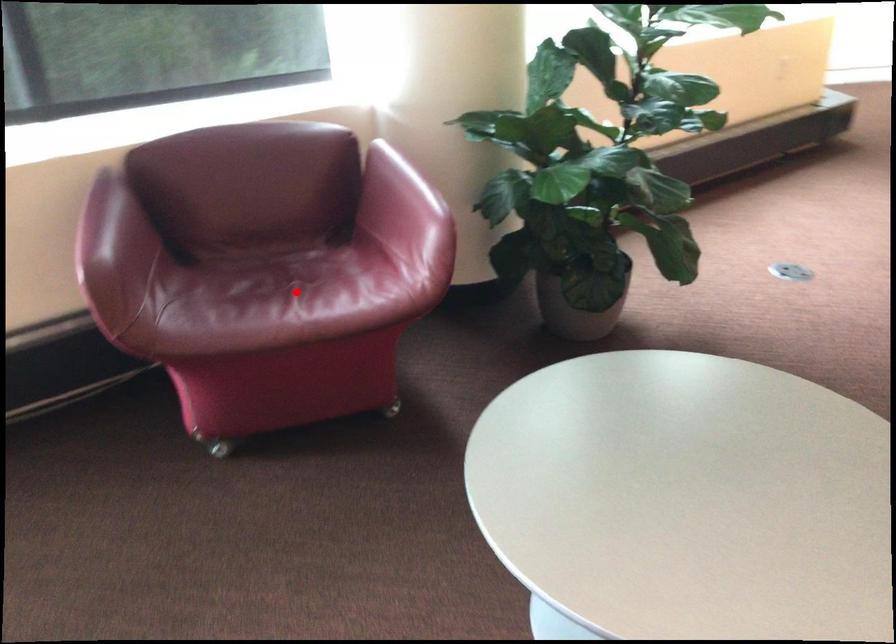
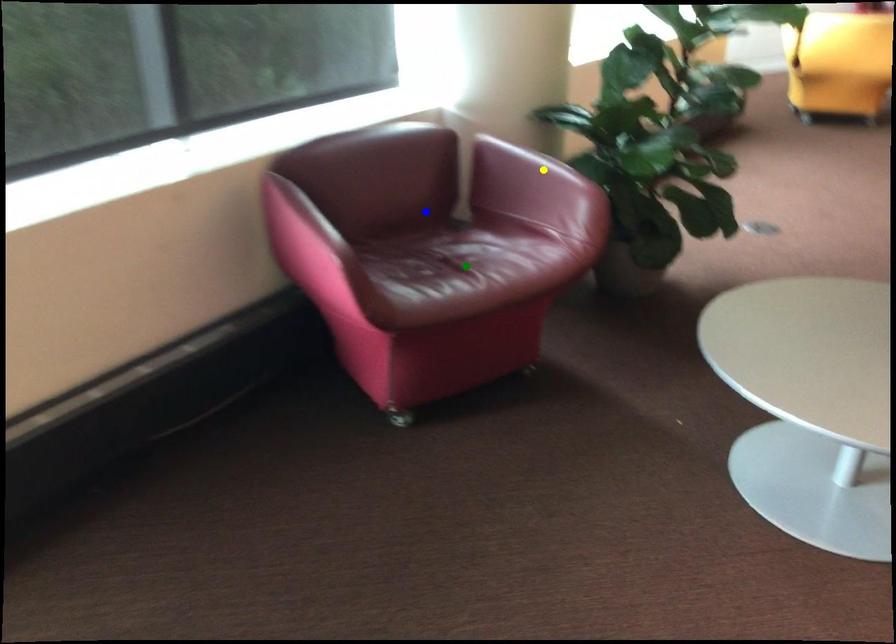
Question: I am providing you with two images of the same scene from different viewpoints. A red point is marked on the first image. You are given multiple points on the second image. In image 2, which mark is for the same physical point as the one in image 1?

Choices:
 (A) green point
 (B) blue point
 (C) yellow point

Answer: (A)